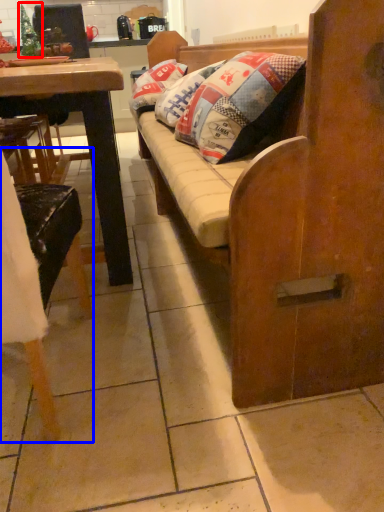
Question: Which object appears farthest to the camera in this image, christmas tree (highlighted by a red box) or chair (highlighted by a blue box)?

Choices:
 (A) christmas tree
 (B) chair

Answer: (A)